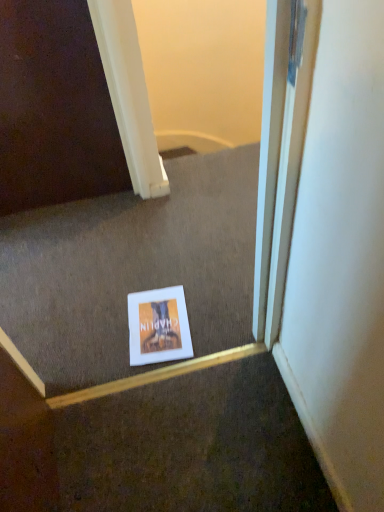
Identify the location of free region under matte cardboard book at center (from a real-world perspective). (154, 327).